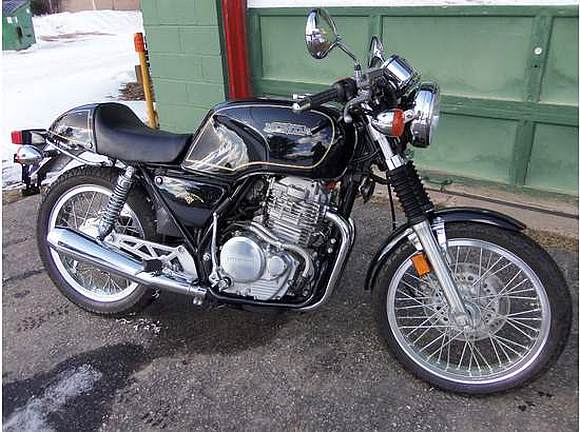
This screenshot has width=580, height=432. Identify the location of wall. 172,69.